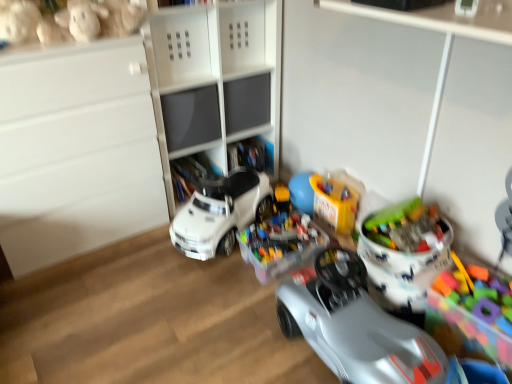
Image resolution: width=512 pixels, height=384 pixels. Describe the element at coordinates (247, 102) in the screenshot. I see `matte gray cabinet at center, the 1th shelf positioned from the bottom` at that location.

Describe the element at coordinates (327, 198) in the screenshot. Image resolution: width=512 pixels, height=384 pixels. I see `translucent plastic container at center, acting as the third toy starting from the right` at that location.

The height and width of the screenshot is (384, 512). What do you see at coordinates (18, 21) in the screenshot?
I see `fluffy beige teddy bear at upper left, which is the 7th toy from right to left` at bounding box center [18, 21].

The height and width of the screenshot is (384, 512). What do you see at coordinates (374, 313) in the screenshot? I see `shiny plastic toy car at center` at bounding box center [374, 313].

This screenshot has height=384, width=512. What do you see at coordinates (221, 213) in the screenshot?
I see `white plastic toy car at center, the 3th toy in the left-to-right sequence` at bounding box center [221, 213].

The image size is (512, 384). Find the location of `multicolored plastic blocks at right, which is counted as the 1th toy, starting from the right`. multicolored plastic blocks at right, which is counted as the 1th toy, starting from the right is located at coordinates (467, 329).

The height and width of the screenshot is (384, 512). There is a translucent plastic container at center, acting as the 4th toy starting from the right. Identify the location of the 5th toy above it (from a real-world perspective). (18, 21).

Is fluffy beige teddy bear at upper left, which is the 7th toy from right to left, next to translucent plastic container at center, acting as the 4th toy starting from the right?

fluffy beige teddy bear at upper left, which is the 7th toy from right to left, and translucent plastic container at center, acting as the 4th toy starting from the right, are not in contact.

Which is more to the left, fluffy beige teddy bear at upper left, which is the 7th toy from right to left, or translucent plastic container at center, which is the fourth toy from left to right?

fluffy beige teddy bear at upper left, which is the 7th toy from right to left, is more to the left.

Between point (15, 40) and point (278, 275), which one is positioned behind?

The point (278, 275) is more distant.

Does white matte cabinet at upper center, which appears as the 1th shelf when viewed from the top, appear on the left side of translucent plastic container at center, which is the fourth toy from left to right?

Correct, you'll find white matte cabinet at upper center, which appears as the 1th shelf when viewed from the top, to the left of translucent plastic container at center, which is the fourth toy from left to right.

Is white matte cabinet at upper center, positioned as the 2th shelf in bottom-to-top order, in front of translucent plastic container at center, acting as the 4th toy starting from the right?

No, white matte cabinet at upper center, positioned as the 2th shelf in bottom-to-top order, is further to the viewer.

From the image's perspective, starting from the translucent plastic container at center, acting as the 4th toy starting from the right, which shelf is the 2nd one above? Please provide its 2D coordinates.

[(247, 36)]

Is white matte cabinet at upper center, which appears as the 1th shelf when viewed from the top, far away from translucent plastic container at center, which is the fourth toy from left to right?

No.

Is translucent plastic container at center, acting as the third toy starting from the right, facing towards fluffy beige teddy bear at upper left, the first toy when ordered from left to right?

No.

Can you confirm if translucent plastic container at center, positioned as the 5th toy in left-to-right order, is bigger than fluffy beige teddy bear at upper left, the first toy when ordered from left to right?

Actually, translucent plastic container at center, positioned as the 5th toy in left-to-right order, might be smaller than fluffy beige teddy bear at upper left, the first toy when ordered from left to right.

Considering the relative sizes of translucent plastic container at center, acting as the third toy starting from the right, and fluffy beige teddy bear at upper left, which is the 7th toy from right to left, in the image provided, is translucent plastic container at center, acting as the third toy starting from the right, thinner than fluffy beige teddy bear at upper left, which is the 7th toy from right to left,?

Yes, translucent plastic container at center, acting as the third toy starting from the right, is thinner than fluffy beige teddy bear at upper left, which is the 7th toy from right to left.

Between point (307, 198) and point (1, 44), which one is positioned behind?

The point (307, 198) is behind.

From a real-world perspective, which object stands above the other?

white plastic toy car at center, the 3th toy in the left-to-right sequence.

Is translucent plastic container at center, acting as the third toy starting from the right, wider than white plastic toy car at center, the 3th toy in the left-to-right sequence?

In fact, translucent plastic container at center, acting as the third toy starting from the right, might be narrower than white plastic toy car at center, the 3th toy in the left-to-right sequence.

From the image's perspective, between translucent plastic container at center, acting as the third toy starting from the right, and white plastic toy car at center, positioned as the fifth toy in right-to-left order, who is located below?

translucent plastic container at center, acting as the third toy starting from the right, appears lower in the image.

Is translucent plastic container at center, acting as the third toy starting from the right, smaller than white plastic toy car at center, positioned as the fifth toy in right-to-left order?

Yes, translucent plastic container at center, acting as the third toy starting from the right, is smaller than white plastic toy car at center, positioned as the fifth toy in right-to-left order.

Does point (279, 217) come closer to viewer compared to point (88, 37)?

No, it is behind (88, 37).

Is translucent plastic container at center, which is the fourth toy from left to right, looking in the opposite direction of fluffy beige teddy bear at upper left, acting as the 6th toy starting from the right?

No, fluffy beige teddy bear at upper left, acting as the 6th toy starting from the right, is not at the back of translucent plastic container at center, which is the fourth toy from left to right.

Considering the positions of objects translucent plastic container at center, acting as the 4th toy starting from the right, and fluffy beige teddy bear at upper left, acting as the 6th toy starting from the right, in the image provided, who is in front, translucent plastic container at center, acting as the 4th toy starting from the right, or fluffy beige teddy bear at upper left, acting as the 6th toy starting from the right,?

fluffy beige teddy bear at upper left, acting as the 6th toy starting from the right, is closer to the camera.

The width and height of the screenshot is (512, 384). Identify the location of the 2nd toy in front of the translucent plastic container at center, acting as the 4th toy starting from the right. (68, 21).

From the image's perspective, which object appears higher, multicolored plastic blocks at right, the seventh toy in the left-to-right sequence, or white plastic toy car at center, positioned as the fifth toy in right-to-left order?

white plastic toy car at center, positioned as the fifth toy in right-to-left order, appears higher in the image.

This screenshot has height=384, width=512. Find the location of `the 4th toy positioned below the white plastic toy car at center, positioned as the fifth toy in right-to-left order (from the image's perspective)`. the 4th toy positioned below the white plastic toy car at center, positioned as the fifth toy in right-to-left order (from the image's perspective) is located at coordinates (467, 329).

Considering the relative sizes of multicolored plastic blocks at right, the seventh toy in the left-to-right sequence, and white plastic toy car at center, positioned as the fifth toy in right-to-left order, in the image provided, is multicolored plastic blocks at right, the seventh toy in the left-to-right sequence, shorter than white plastic toy car at center, positioned as the fifth toy in right-to-left order,?

Correct, multicolored plastic blocks at right, the seventh toy in the left-to-right sequence, is not as tall as white plastic toy car at center, positioned as the fifth toy in right-to-left order.

From the image's perspective, which object appears higher, translucent plastic container at center, positioned as the 5th toy in left-to-right order, or fluffy beige teddy bear at upper left, acting as the 6th toy starting from the right?

From the image's view, fluffy beige teddy bear at upper left, acting as the 6th toy starting from the right, is above.

Is the depth of translucent plastic container at center, positioned as the 5th toy in left-to-right order, greater than that of fluffy beige teddy bear at upper left, acting as the 6th toy starting from the right?

Yes, it is behind fluffy beige teddy bear at upper left, acting as the 6th toy starting from the right.

Where is `toy that is the 3rd one when counting upward from the translucent plastic container at center, acting as the third toy starting from the right (from the image's perspective)`? toy that is the 3rd one when counting upward from the translucent plastic container at center, acting as the third toy starting from the right (from the image's perspective) is located at coordinates (68, 21).

Considering the sizes of objects translucent plastic container at center, positioned as the 5th toy in left-to-right order, and fluffy beige teddy bear at upper left, acting as the 6th toy starting from the right, in the image provided, who is smaller, translucent plastic container at center, positioned as the 5th toy in left-to-right order, or fluffy beige teddy bear at upper left, acting as the 6th toy starting from the right,?

Smaller between the two is translucent plastic container at center, positioned as the 5th toy in left-to-right order.

From the image's perspective, starting from the fluffy beige teddy bear at upper left, the first toy when ordered from left to right, which toy is the 4th one below? Please provide its 2D coordinates.

[(281, 240)]

From a real-world perspective, starting from the white matte cabinet at upper center, which appears as the 1th shelf when viewed from the top, which toy is the 5th one below it? Please provide its 2D coordinates.

[(281, 240)]

Considering their positions, is white matte cabinet at upper center, which appears as the 1th shelf when viewed from the top, positioned further to translucent plastic container at center, acting as the 4th toy starting from the right, than multicolored plastic blocks at right, the seventh toy in the left-to-right sequence?

white matte cabinet at upper center, which appears as the 1th shelf when viewed from the top.

Looking at the image, which one is located closer to white matte cabinet at upper center, positioned as the 2th shelf in bottom-to-top order, translucent plastic toy at center right, acting as the 6th toy starting from the left, or fluffy beige teddy bear at upper left, the 2th toy viewed from the left?

fluffy beige teddy bear at upper left, the 2th toy viewed from the left.

Based on their spatial positions, is white plastic toy car at center, positioned as the fifth toy in right-to-left order, or shiny plastic toy car at center further from translucent plastic container at center, which is the fourth toy from left to right?

shiny plastic toy car at center.

Looking at this image, estimate the real-world distances between objects in this image. Which object is further from translucent plastic container at center, positioned as the 5th toy in left-to-right order, fluffy beige teddy bear at upper left, which is the 7th toy from right to left, or white plastic toy car at center, positioned as the fifth toy in right-to-left order?

fluffy beige teddy bear at upper left, which is the 7th toy from right to left, is positioned further to the anchor translucent plastic container at center, positioned as the 5th toy in left-to-right order.

Based on their spatial positions, is translucent plastic container at center, acting as the third toy starting from the right, or multicolored plastic blocks at right, the seventh toy in the left-to-right sequence, closer to white plastic toy car at center, the 3th toy in the left-to-right sequence?

translucent plastic container at center, acting as the third toy starting from the right, is closer to white plastic toy car at center, the 3th toy in the left-to-right sequence.

From the image, which object appears to be nearer to fluffy beige teddy bear at upper left, the 2th toy viewed from the left, multicolored plastic blocks at right, which is counted as the 1th toy, starting from the right, or translucent plastic container at center, acting as the 4th toy starting from the right?

translucent plastic container at center, acting as the 4th toy starting from the right, is closer to fluffy beige teddy bear at upper left, the 2th toy viewed from the left.

Based on their spatial positions, is white plastic toy car at center, positioned as the fifth toy in right-to-left order, or translucent plastic toy at center right, positioned as the 2th toy in right-to-left order, closer to white matte cabinet at upper center, positioned as the 2th shelf in bottom-to-top order?

The object closer to white matte cabinet at upper center, positioned as the 2th shelf in bottom-to-top order, is white plastic toy car at center, positioned as the fifth toy in right-to-left order.

Considering their positions, is fluffy beige teddy bear at upper left, the 2th toy viewed from the left, positioned further to multicolored plastic blocks at right, which is counted as the 1th toy, starting from the right, than fluffy beige teddy bear at upper left, the first toy when ordered from left to right?

fluffy beige teddy bear at upper left, the first toy when ordered from left to right, is further to multicolored plastic blocks at right, which is counted as the 1th toy, starting from the right.

Identify the location of shelf between fluffy beige teddy bear at upper left, acting as the 6th toy starting from the right, and matte gray cabinet at center, the 2th shelf from the top. (247, 36).

At what (x,y) coordinates should I click in order to perform the action: click on shelf between white matte cabinet at upper center, positioned as the 2th shelf in bottom-to-top order, and shiny plastic toy car at center from top to bottom. Please return your answer as a coordinate pair (x, y). The height and width of the screenshot is (384, 512). Looking at the image, I should click on (247, 102).

The image size is (512, 384). In order to click on collection located between fluffy beige teddy bear at upper left, which is the 7th toy from right to left, and translucent plastic toy at center right, acting as the 6th toy starting from the left, in the left-right direction in this screenshot , I will do `click(374, 313)`.

The image size is (512, 384). I want to click on collection between white plastic toy car at center, the 3th toy in the left-to-right sequence, and translucent plastic toy at center right, acting as the 6th toy starting from the left, from left to right, so click(374, 313).